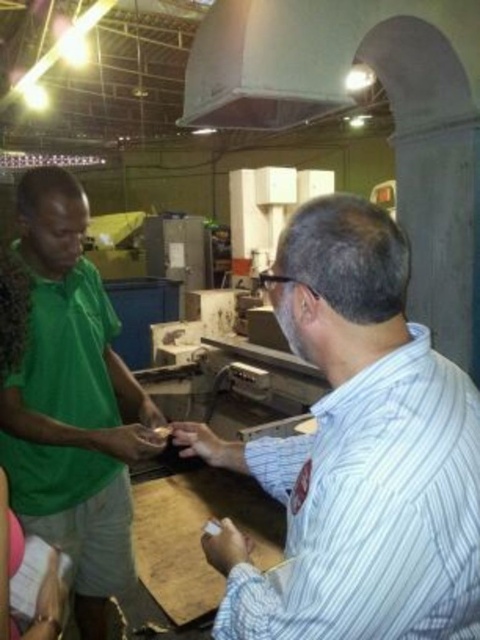
Question: Can you confirm if white striped shirt at right is wider than green fabric shirt at left?

Choices:
 (A) no
 (B) yes

Answer: (B)

Question: Is the position of white striped shirt at right more distant than that of green fabric shirt at left?

Choices:
 (A) yes
 (B) no

Answer: (B)

Question: Which object appears closest to the camera in this image?

Choices:
 (A) white striped shirt at right
 (B) green fabric shirt at left
 (C) green matte shirt at left

Answer: (A)

Question: Which object is the farthest from the green matte shirt at left?

Choices:
 (A) white striped shirt at right
 (B) green fabric shirt at left

Answer: (A)

Question: Which point is farther to the camera?

Choices:
 (A) green matte shirt at left
 (B) green fabric shirt at left

Answer: (A)

Question: Is the position of green matte shirt at left less distant than that of green fabric shirt at left?

Choices:
 (A) yes
 (B) no

Answer: (B)